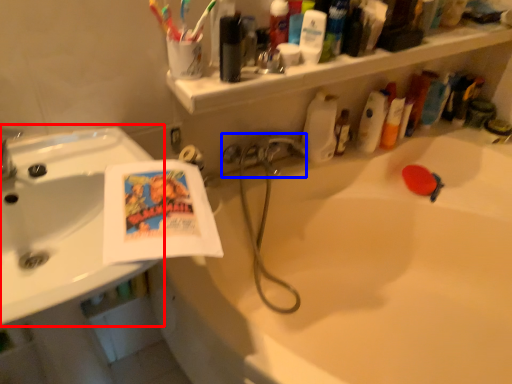
Question: Which object appears farthest to the camera in this image, sink (highlighted by a red box) or plumbing fixture (highlighted by a blue box)?

Choices:
 (A) sink
 (B) plumbing fixture

Answer: (B)